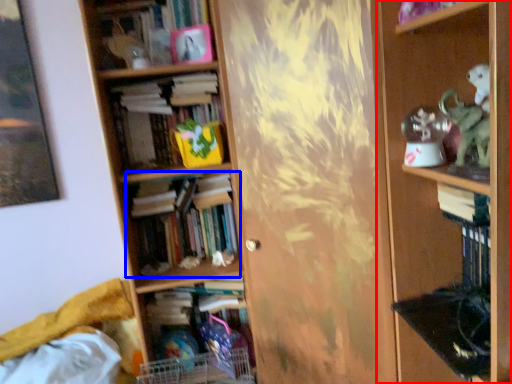
Question: Which object is closer to the camera taking this photo, shelf (highlighted by a red box) or book (highlighted by a blue box)?

Choices:
 (A) shelf
 (B) book

Answer: (A)